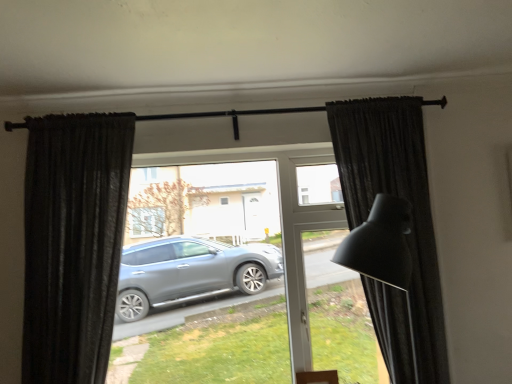
Where is `black textured curtain at left, which ranks as the first curtain in left-to-right order`? black textured curtain at left, which ranks as the first curtain in left-to-right order is located at coordinates (73, 242).

What do you see at coordinates (73, 242) in the screenshot?
I see `black textured curtain at left, marked as the 2th curtain in a right-to-left arrangement` at bounding box center [73, 242].

The width and height of the screenshot is (512, 384). Describe the element at coordinates (405, 236) in the screenshot. I see `dark matte curtain at right, which is counted as the 1th curtain, starting from the right` at that location.

Image resolution: width=512 pixels, height=384 pixels. I want to click on dark matte curtain at right, the second curtain in the left-to-right sequence, so click(405, 236).

Where is `black textured curtain at left, which ranks as the first curtain in left-to-right order`? Image resolution: width=512 pixels, height=384 pixels. black textured curtain at left, which ranks as the first curtain in left-to-right order is located at coordinates (73, 242).

Considering the relative positions of dark matte curtain at right, which is counted as the 1th curtain, starting from the right, and black textured curtain at left, marked as the 2th curtain in a right-to-left arrangement, in the image provided, is dark matte curtain at right, which is counted as the 1th curtain, starting from the right, to the left or to the right of black textured curtain at left, marked as the 2th curtain in a right-to-left arrangement,?

Clearly, dark matte curtain at right, which is counted as the 1th curtain, starting from the right, is on the right of black textured curtain at left, marked as the 2th curtain in a right-to-left arrangement, in the image.

Looking at this image, considering the positions of objects dark matte curtain at right, the second curtain in the left-to-right sequence, and black textured curtain at left, which ranks as the first curtain in left-to-right order, in the image provided, who is behind, dark matte curtain at right, the second curtain in the left-to-right sequence, or black textured curtain at left, which ranks as the first curtain in left-to-right order,?

black textured curtain at left, which ranks as the first curtain in left-to-right order, is behind.

Is point (412, 339) behind point (117, 162)?

That is False.

From the image's perspective, is dark matte curtain at right, which is counted as the 1th curtain, starting from the right, beneath black textured curtain at left, marked as the 2th curtain in a right-to-left arrangement?

No, from the image's perspective, dark matte curtain at right, which is counted as the 1th curtain, starting from the right, is not below black textured curtain at left, marked as the 2th curtain in a right-to-left arrangement.

From a real-world perspective, relative to black textured curtain at left, marked as the 2th curtain in a right-to-left arrangement, is dark matte curtain at right, the second curtain in the left-to-right sequence, vertically above or below?

Clearly, from a real-world perspective, dark matte curtain at right, the second curtain in the left-to-right sequence, is below black textured curtain at left, marked as the 2th curtain in a right-to-left arrangement.

Between dark matte curtain at right, the second curtain in the left-to-right sequence, and black textured curtain at left, marked as the 2th curtain in a right-to-left arrangement, which one has larger width?

With larger width is dark matte curtain at right, the second curtain in the left-to-right sequence.

Considering the sizes of objects dark matte curtain at right, the second curtain in the left-to-right sequence, and black textured curtain at left, which ranks as the first curtain in left-to-right order, in the image provided, who is taller, dark matte curtain at right, the second curtain in the left-to-right sequence, or black textured curtain at left, which ranks as the first curtain in left-to-right order,?

Standing taller between the two is dark matte curtain at right, the second curtain in the left-to-right sequence.

Is dark matte curtain at right, which is counted as the 1th curtain, starting from the right, bigger or smaller than black textured curtain at left, which ranks as the first curtain in left-to-right order?

Clearly, dark matte curtain at right, which is counted as the 1th curtain, starting from the right, is larger in size than black textured curtain at left, which ranks as the first curtain in left-to-right order.

Looking at this image, would you say dark matte curtain at right, which is counted as the 1th curtain, starting from the right, is outside black textured curtain at left, which ranks as the first curtain in left-to-right order?

dark matte curtain at right, which is counted as the 1th curtain, starting from the right, lies outside black textured curtain at left, which ranks as the first curtain in left-to-right order,'s area.

Is dark matte curtain at right, the second curtain in the left-to-right sequence, touching black textured curtain at left, marked as the 2th curtain in a right-to-left arrangement?

No, dark matte curtain at right, the second curtain in the left-to-right sequence, is not next to black textured curtain at left, marked as the 2th curtain in a right-to-left arrangement.

Could you tell me if dark matte curtain at right, the second curtain in the left-to-right sequence, is turned towards black textured curtain at left, which ranks as the first curtain in left-to-right order?

No, dark matte curtain at right, the second curtain in the left-to-right sequence, is not turned towards black textured curtain at left, which ranks as the first curtain in left-to-right order.

How far apart are dark matte curtain at right, the second curtain in the left-to-right sequence, and black textured curtain at left, marked as the 2th curtain in a right-to-left arrangement?

4.43 feet.

The image size is (512, 384). In the image, there is a black textured curtain at left, marked as the 2th curtain in a right-to-left arrangement. Identify the location of curtain below it (from a real-world perspective). (405, 236).

Between black textured curtain at left, which ranks as the first curtain in left-to-right order, and dark matte curtain at right, the second curtain in the left-to-right sequence, which one appears on the left side from the viewer's perspective?

black textured curtain at left, which ranks as the first curtain in left-to-right order, is more to the left.

From the picture: Who is more distant, black textured curtain at left, marked as the 2th curtain in a right-to-left arrangement, or dark matte curtain at right, which is counted as the 1th curtain, starting from the right?

black textured curtain at left, marked as the 2th curtain in a right-to-left arrangement, is more distant.

Which is further, (103, 133) or (348, 127)?

Point (348, 127)

From the image's perspective, is black textured curtain at left, which ranks as the first curtain in left-to-right order, beneath dark matte curtain at right, which is counted as the 1th curtain, starting from the right?

Yes, from the image's perspective, black textured curtain at left, which ranks as the first curtain in left-to-right order, is beneath dark matte curtain at right, which is counted as the 1th curtain, starting from the right.

From a real-world perspective, is black textured curtain at left, marked as the 2th curtain in a right-to-left arrangement, positioned over dark matte curtain at right, the second curtain in the left-to-right sequence, based on gravity?

Yes, from a real-world perspective, black textured curtain at left, marked as the 2th curtain in a right-to-left arrangement, is over dark matte curtain at right, the second curtain in the left-to-right sequence

Consider the image. Which object is wider, black textured curtain at left, which ranks as the first curtain in left-to-right order, or dark matte curtain at right, which is counted as the 1th curtain, starting from the right?

With larger width is dark matte curtain at right, which is counted as the 1th curtain, starting from the right.

Considering the relative sizes of black textured curtain at left, which ranks as the first curtain in left-to-right order, and dark matte curtain at right, which is counted as the 1th curtain, starting from the right, in the image provided, is black textured curtain at left, which ranks as the first curtain in left-to-right order, shorter than dark matte curtain at right, which is counted as the 1th curtain, starting from the right,?

Yes.

Can you confirm if black textured curtain at left, marked as the 2th curtain in a right-to-left arrangement, is smaller than dark matte curtain at right, which is counted as the 1th curtain, starting from the right?

Yes.

Is black textured curtain at left, marked as the 2th curtain in a right-to-left arrangement, positioned beyond the bounds of dark matte curtain at right, which is counted as the 1th curtain, starting from the right?

Absolutely, black textured curtain at left, marked as the 2th curtain in a right-to-left arrangement, is external to dark matte curtain at right, which is counted as the 1th curtain, starting from the right.

Is there a large distance between black textured curtain at left, which ranks as the first curtain in left-to-right order, and dark matte curtain at right, which is counted as the 1th curtain, starting from the right?

Yes.

Is black textured curtain at left, which ranks as the first curtain in left-to-right order, oriented towards dark matte curtain at right, which is counted as the 1th curtain, starting from the right?

No.

Looking at this image, could you measure the distance between black textured curtain at left, which ranks as the first curtain in left-to-right order, and dark matte curtain at right, which is counted as the 1th curtain, starting from the right?

black textured curtain at left, which ranks as the first curtain in left-to-right order, and dark matte curtain at right, which is counted as the 1th curtain, starting from the right, are 1.35 meters apart from each other.

This screenshot has width=512, height=384. Find the location of `curtain that is above the dark matte curtain at right, which is counted as the 1th curtain, starting from the right (from a real-world perspective)`. curtain that is above the dark matte curtain at right, which is counted as the 1th curtain, starting from the right (from a real-world perspective) is located at coordinates (73, 242).

The height and width of the screenshot is (384, 512). What are the coordinates of `curtain that is on the left side of dark matte curtain at right, the second curtain in the left-to-right sequence` in the screenshot? It's located at (73, 242).

Where is `curtain on the right of black textured curtain at left, which ranks as the first curtain in left-to-right order`? The image size is (512, 384). curtain on the right of black textured curtain at left, which ranks as the first curtain in left-to-right order is located at coordinates (405, 236).